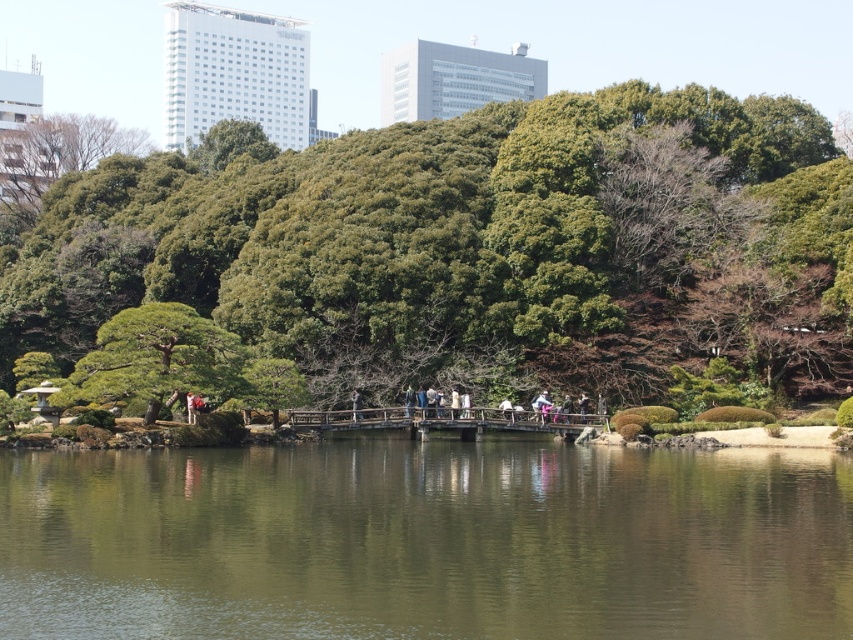
Question: Which object is closer to the camera taking this photo?

Choices:
 (A) green leafy tree at center
 (B) green reflective water at center

Answer: (B)

Question: Is green reflective water at center further to camera compared to green textured tree at center?

Choices:
 (A) no
 (B) yes

Answer: (A)

Question: Is green reflective water at center closer to camera compared to green textured tree at center?

Choices:
 (A) yes
 (B) no

Answer: (A)

Question: Which object is the closest to the green reflective water at center?

Choices:
 (A) green textured tree at center
 (B) green leafy tree at center

Answer: (A)

Question: Can you confirm if green leafy tree at center is bigger than green textured tree at center?

Choices:
 (A) no
 (B) yes

Answer: (B)

Question: Which is farther from the green leafy tree at center?

Choices:
 (A) green textured tree at center
 (B) green reflective water at center

Answer: (B)